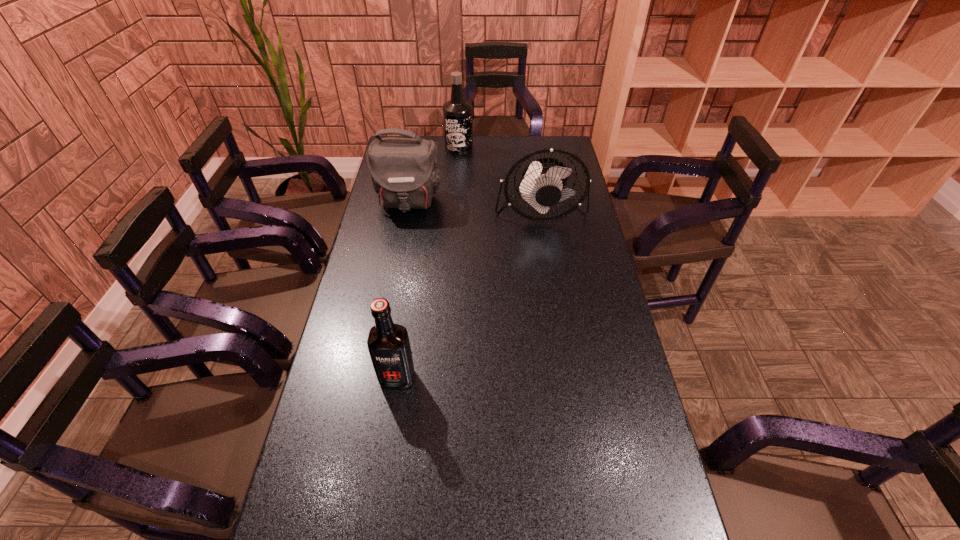
Where is `object at the far edge`? This screenshot has width=960, height=540. object at the far edge is located at coordinates (457, 113).

This screenshot has width=960, height=540. I want to click on liquor positioned at the left edge, so click(388, 344).

You are a GUI agent. You are given a task and a screenshot of the screen. Output one action in this format:
    pyautogui.click(x=<x>, y=<y>)
    Task: Click on the shoulder bag situated at the left edge
    
    Given the screenshot: What is the action you would take?
    pos(404,172)

Identify the location of object present at the right edge. (542, 183).

The image size is (960, 540). Find the location of `vacant space at the far edge of the desktop`. vacant space at the far edge of the desktop is located at coordinates (465, 157).

Locate an element on the screen. vacant space at the left edge of the desktop is located at coordinates (299, 529).

The width and height of the screenshot is (960, 540). In order to click on vacant space at the right edge of the desktop in this screenshot , I will do `click(580, 276)`.

Locate an element on the screen. The height and width of the screenshot is (540, 960). free space that is in between the nearer liquor and the rightmost object is located at coordinates (468, 294).

Where is `vacant space in between the nearest object and the right liquor`? Image resolution: width=960 pixels, height=540 pixels. vacant space in between the nearest object and the right liquor is located at coordinates (428, 263).

Locate an element on the screen. The image size is (960, 540). unoccupied position between the shoulder bag and the rightmost object is located at coordinates (474, 206).